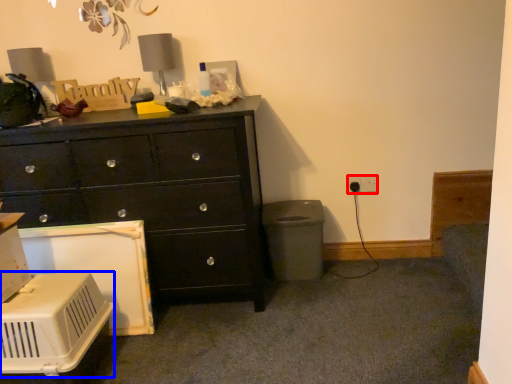
Question: Which object is closer to the camera taking this photo, electric outlet (highlighted by a red box) or appliance (highlighted by a blue box)?

Choices:
 (A) electric outlet
 (B) appliance

Answer: (B)